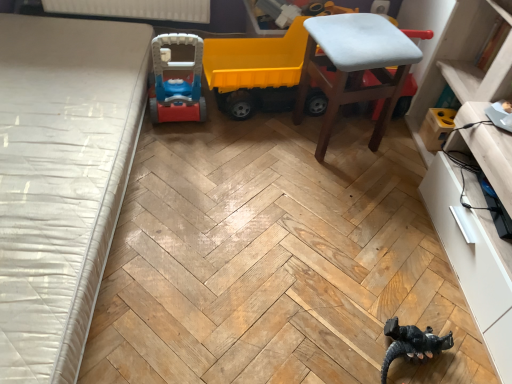
At what (x,y) coordinates should I click in order to perform the action: click on blank space situated above light blue fabric stool at upper right (from a real-world perspective). Please return your answer as a coordinate pair (x, y). Looking at the image, I should click on (375, 37).